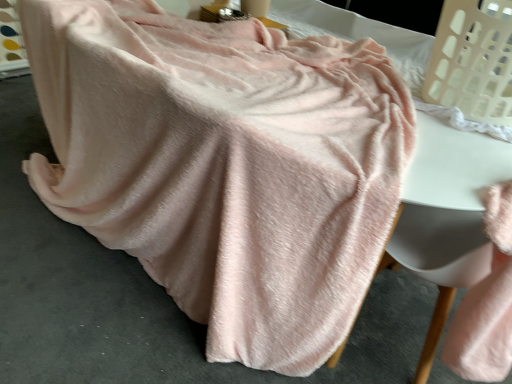
Question: From a real-world perspective, is soft pink fabric at lower right beneath white plastic laundry basket at upper right?

Choices:
 (A) yes
 (B) no

Answer: (A)

Question: Is soft pink fabric at lower right further to camera compared to white plastic laundry basket at upper right?

Choices:
 (A) no
 (B) yes

Answer: (A)

Question: Is soft pink fabric at lower right wider than white plastic laundry basket at upper right?

Choices:
 (A) no
 (B) yes

Answer: (A)

Question: Considering the relative sizes of soft pink fabric at lower right and white plastic laundry basket at upper right in the image provided, is soft pink fabric at lower right shorter than white plastic laundry basket at upper right?

Choices:
 (A) yes
 (B) no

Answer: (B)

Question: Is soft pink fabric at lower right to the right of white plastic laundry basket at upper right from the viewer's perspective?

Choices:
 (A) no
 (B) yes

Answer: (A)

Question: Does soft pink fabric at lower right have a lesser width compared to white plastic laundry basket at upper right?

Choices:
 (A) yes
 (B) no

Answer: (A)

Question: Is soft pink fabric at lower right inside white plastic laundry basket at upper right?

Choices:
 (A) no
 (B) yes

Answer: (A)

Question: From the image's perspective, is white plastic laundry basket at upper right located beneath soft pink fabric at lower right?

Choices:
 (A) no
 (B) yes

Answer: (A)

Question: Is white plastic laundry basket at upper right aimed at soft pink fabric at lower right?

Choices:
 (A) yes
 (B) no

Answer: (B)

Question: Does white plastic laundry basket at upper right touch soft pink fabric at lower right?

Choices:
 (A) yes
 (B) no

Answer: (B)

Question: Does white plastic laundry basket at upper right have a greater height compared to soft pink fabric at lower right?

Choices:
 (A) yes
 (B) no

Answer: (B)

Question: Is white plastic laundry basket at upper right not within soft pink fabric at lower right?

Choices:
 (A) no
 (B) yes

Answer: (B)

Question: Considering the positions of soft pink fabric at lower right and white plastic laundry basket at upper right in the image, is soft pink fabric at lower right taller or shorter than white plastic laundry basket at upper right?

Choices:
 (A) tall
 (B) short

Answer: (A)